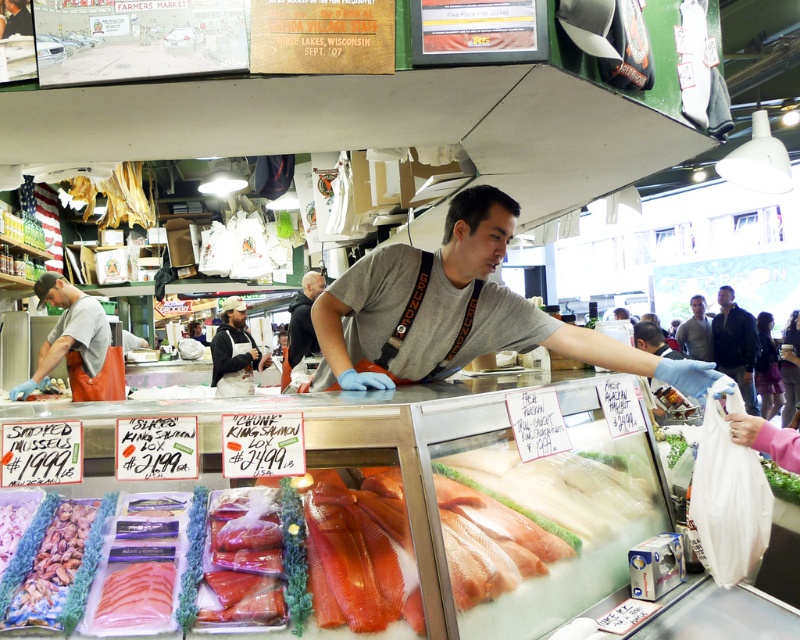
Is shiny brown mussels at lower left wider than orange apron at left?

No, shiny brown mussels at lower left is not wider than orange apron at left.

Does point (48, 566) come behind point (92, 355)?

No, (48, 566) is closer to viewer.

Does point (73, 602) come behind point (72, 384)?

No, (73, 602) is in front of (72, 384).

Where is `shiny brown mussels at lower left`? Image resolution: width=800 pixels, height=640 pixels. shiny brown mussels at lower left is located at coordinates (54, 564).

Looking at this image, who is positioned more to the left, pinkish translucent salmon at center or dark brown leather jacket at upper right?

Positioned to the left is pinkish translucent salmon at center.

Find the location of a particular element. The width and height of the screenshot is (800, 640). pinkish translucent salmon at center is located at coordinates (244, 561).

Who is higher up, dark blue fabric at lower right or smooth plastic bag at lower right?

smooth plastic bag at lower right

Between point (770, 417) and point (798, 378), which one is positioned behind?

Point (798, 378)

Who is more forward, [756,328] or [794,403]?

Positioned in front is point [794,403].

The height and width of the screenshot is (640, 800). What are the coordinates of `dark blue fabric at lower right` in the screenshot? It's located at (768, 369).